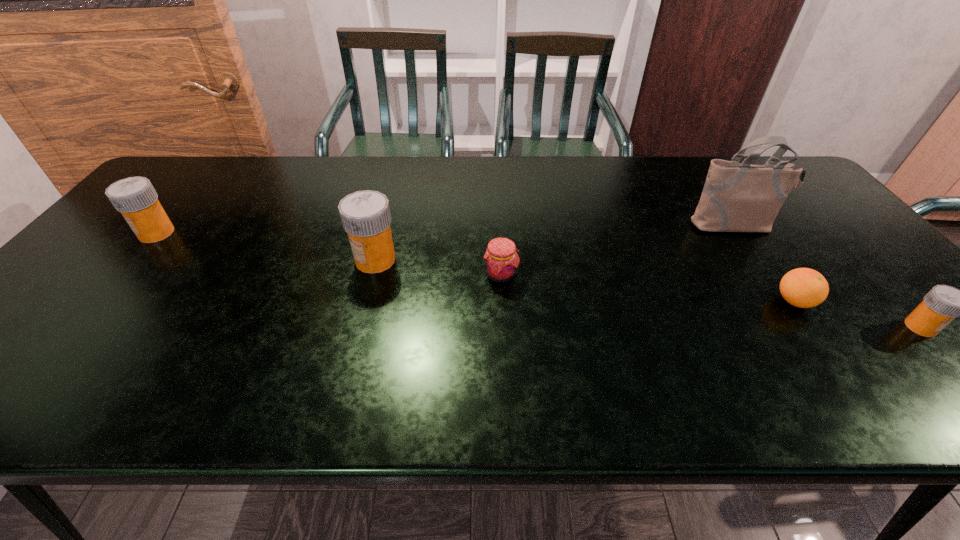
Where is `object positioned at the right edge`? Image resolution: width=960 pixels, height=540 pixels. object positioned at the right edge is located at coordinates (942, 304).

Where is `object located in the near right corner section of the desktop`? The image size is (960, 540). object located in the near right corner section of the desktop is located at coordinates point(942,304).

I want to click on free location at the far edge, so click(x=666, y=167).

Find the location of a particular element. vacant space at the near edge is located at coordinates (302, 361).

In the image, there is a desktop. Where is `vacant area at the left edge`? vacant area at the left edge is located at coordinates (77, 293).

Locate an element on the screen. free space at the right edge of the desktop is located at coordinates click(785, 202).

Find the location of a particular element. The height and width of the screenshot is (540, 960). vacant space at the far left corner of the desktop is located at coordinates (218, 163).

Find the location of a particular element. This screenshot has width=960, height=540. vacant point located between the orange and the jam is located at coordinates (648, 288).

At what (x,y) coordinates should I click in order to perform the action: click on free space that is in between the orange and the shoulder bag. Please return your answer as a coordinate pair (x, y). Looking at the image, I should click on (764, 264).

At what (x,y) coordinates should I click in order to perform the action: click on free point between the jam and the orange. Please return your answer as a coordinate pair (x, y). This screenshot has width=960, height=540. Looking at the image, I should click on (648, 288).